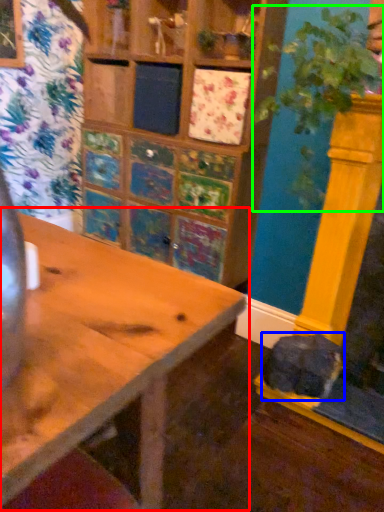
Question: Based on their relative distances, which object is nearer to table (highlighted by a red box)? Choose from animal (highlighted by a blue box) and plant (highlighted by a green box).

Choices:
 (A) animal
 (B) plant

Answer: (B)